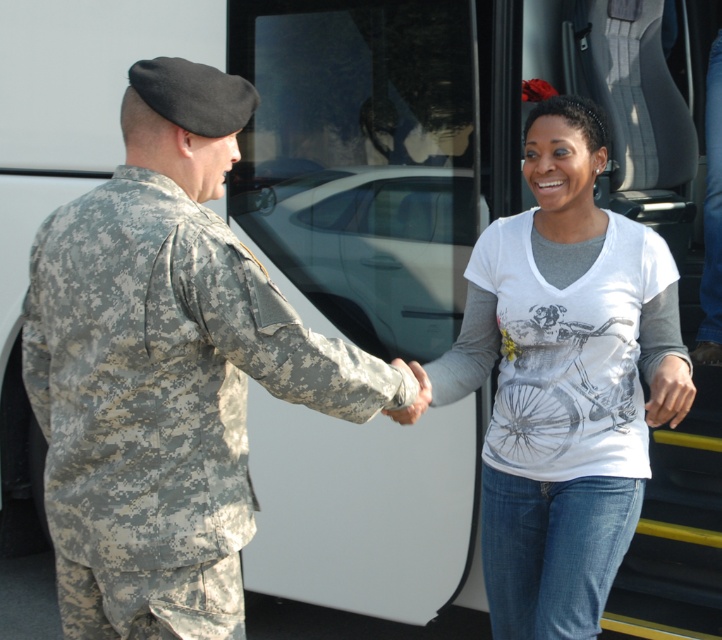
You are standing in front of the bus and see the camouflage uniform at left and the white printed shirt at center. Which one is closer to the open side door of the bus?

The camouflage uniform at left is closer to the open side door of the bus because it is positioned to the left of the white printed shirt at center, and the bus door is on the side where the camouflage uniform at left is located.

You are standing at the point with coordinates point (69, 600) and want to walk towards the bus door. There is an obstacle at point (492, 600). Will you encounter this obstacle before reaching the bus door?

Since point (69, 600) is in front of point (492, 600), you are already closer to the bus door than the obstacle. Therefore, you will reach the bus door before encountering the obstacle at point (492, 600).